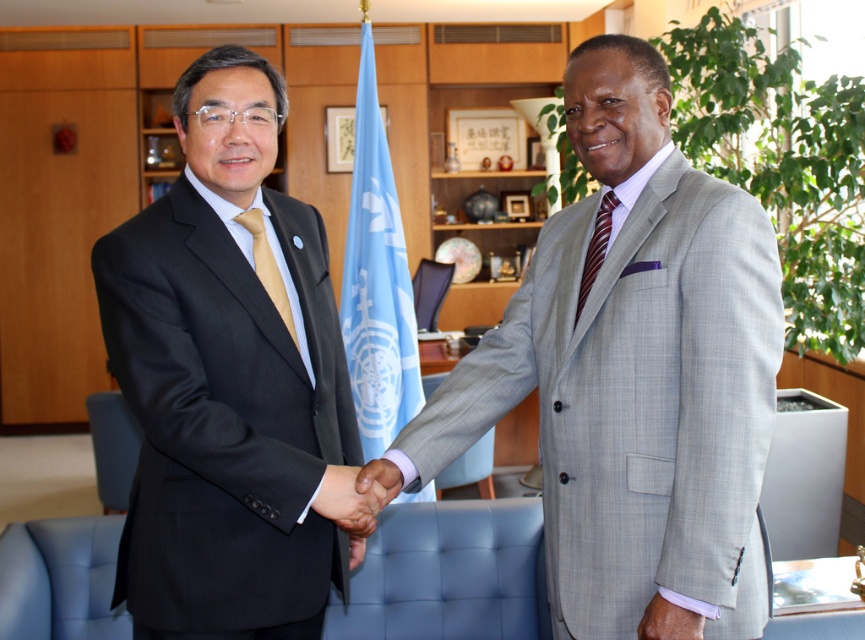
Question: Which point is farther to the camera?

Choices:
 (A) (361, 509)
 (B) (279, 304)
 (C) (577, 248)

Answer: (B)

Question: Where is gray textured suit at center located in relation to light blue fabric flag at center in the image?

Choices:
 (A) above
 (B) below

Answer: (B)

Question: Which of the following is the closest to the observer?

Choices:
 (A) (606, 205)
 (B) (133, 628)
 (C) (671, 637)
 (D) (363, 531)

Answer: (C)

Question: Does gray textured suit at center have a smaller size compared to striped silk tie at right?

Choices:
 (A) no
 (B) yes

Answer: (A)

Question: Is matte black suit at center thinner than light blue fabric flag at center?

Choices:
 (A) no
 (B) yes

Answer: (A)

Question: Which object is closer to the camera taking this photo?

Choices:
 (A) matte gold tie at left
 (B) pink fabric wristband at lower right
 (C) smooth skin handshake at center
 (D) light blue fabric flag at center

Answer: (B)